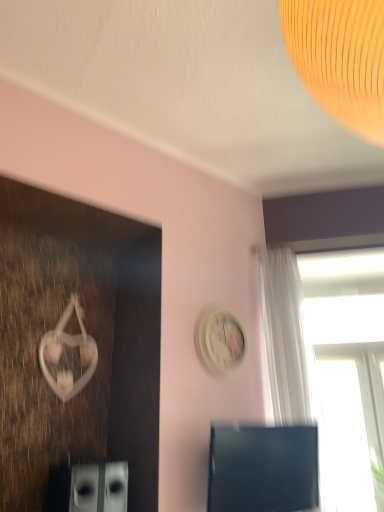
Question: Does black glossy computer monitor at lower right turn towards transparent glass window at upper right?

Choices:
 (A) yes
 (B) no

Answer: (B)

Question: Can you confirm if black glossy computer monitor at lower right is positioned to the left of transparent glass window at upper right?

Choices:
 (A) yes
 (B) no

Answer: (A)

Question: Does black glossy computer monitor at lower right have a smaller size compared to transparent glass window at upper right?

Choices:
 (A) no
 (B) yes

Answer: (B)

Question: Does black glossy computer monitor at lower right have a larger size compared to transparent glass window at upper right?

Choices:
 (A) yes
 (B) no

Answer: (B)

Question: From a real-world perspective, is black glossy computer monitor at lower right located higher than transparent glass window at upper right?

Choices:
 (A) no
 (B) yes

Answer: (A)

Question: Is black glossy computer monitor at lower right located outside transparent glass window at upper right?

Choices:
 (A) yes
 (B) no

Answer: (A)

Question: Is transparent glass window at upper right positioned far away from white glossy clock at upper center?

Choices:
 (A) no
 (B) yes

Answer: (A)

Question: Is transparent glass window at upper right facing towards white glossy clock at upper center?

Choices:
 (A) yes
 (B) no

Answer: (B)

Question: Is transparent glass window at upper right positioned with its back to white glossy clock at upper center?

Choices:
 (A) no
 (B) yes

Answer: (A)

Question: Is transparent glass window at upper right further to camera compared to white glossy clock at upper center?

Choices:
 (A) no
 (B) yes

Answer: (B)

Question: Is transparent glass window at upper right outside of white glossy clock at upper center?

Choices:
 (A) no
 (B) yes

Answer: (B)

Question: Can you confirm if transparent glass window at upper right is thinner than white glossy clock at upper center?

Choices:
 (A) no
 (B) yes

Answer: (A)

Question: Is black glossy computer monitor at lower right looking in the opposite direction of white glossy clock at upper center?

Choices:
 (A) yes
 (B) no

Answer: (B)